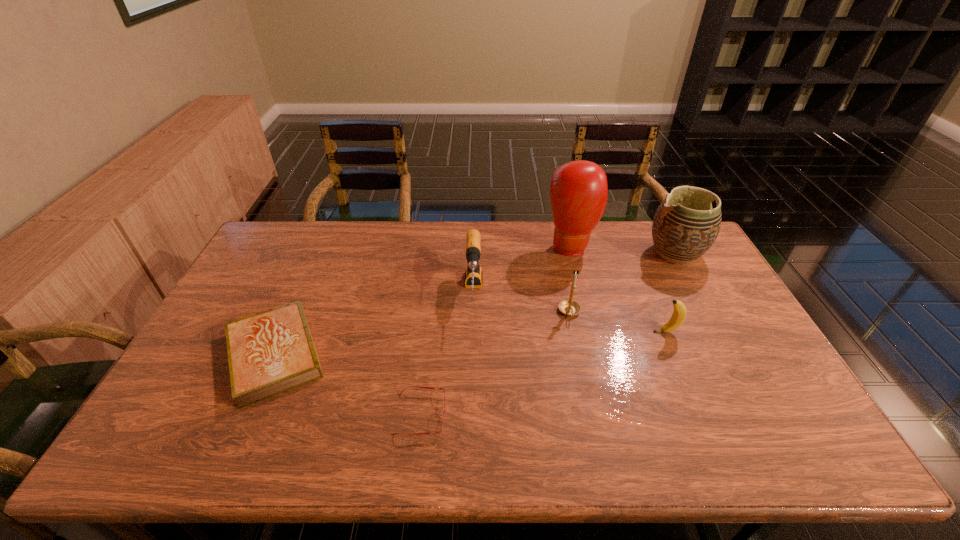
Image resolution: width=960 pixels, height=540 pixels. Identify the location of empty location between the sixth tallest object and the fifth object from right to left. (374, 323).

Where is `object identified as the fifth closest to the tallest object`? This screenshot has height=540, width=960. object identified as the fifth closest to the tallest object is located at coordinates (410, 386).

Locate an element on the screen. object that ranks as the fourth closest to the candle holder is located at coordinates (685, 226).

The image size is (960, 540). Find the location of `vacant space that satisfies the following two spatial constraints: 1. on the handle side of the candle holder; 2. on the lenses of the shortest object`. vacant space that satisfies the following two spatial constraints: 1. on the handle side of the candle holder; 2. on the lenses of the shortest object is located at coordinates (591, 414).